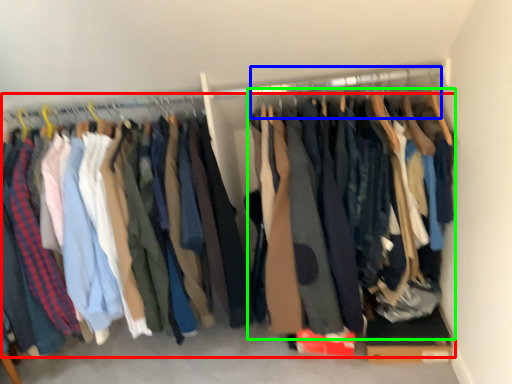
Question: Which object is the farthest from trousers (highlighted by a red box)? Choose among these: hanger (highlighted by a blue box) or clothing (highlighted by a green box).

Choices:
 (A) hanger
 (B) clothing

Answer: (A)